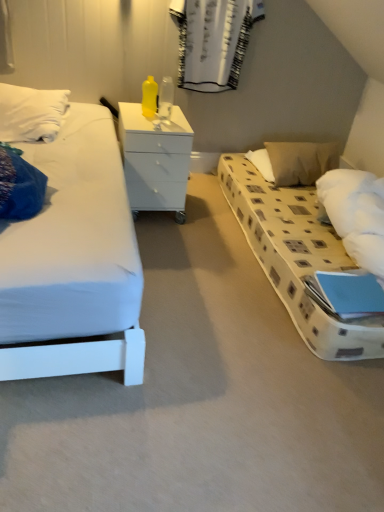
Question: Would you say beige fabric pillow at right is outside white glossy chest of drawers at center?

Choices:
 (A) no
 (B) yes

Answer: (B)

Question: From a real-world perspective, is beige fabric pillow at right positioned under white glossy chest of drawers at center based on gravity?

Choices:
 (A) yes
 (B) no

Answer: (A)

Question: From the image's perspective, is beige fabric pillow at right below white glossy chest of drawers at center?

Choices:
 (A) no
 (B) yes

Answer: (A)

Question: Are beige fabric pillow at right and white glossy chest of drawers at center located far from each other?

Choices:
 (A) yes
 (B) no

Answer: (B)

Question: Is beige fabric pillow at right touching white glossy chest of drawers at center?

Choices:
 (A) no
 (B) yes

Answer: (A)

Question: From the image's perspective, is beige fabric pillow at right positioned above or below white textured curtain at upper center?

Choices:
 (A) above
 (B) below

Answer: (B)

Question: In terms of size, does beige fabric pillow at right appear bigger or smaller than white textured curtain at upper center?

Choices:
 (A) small
 (B) big

Answer: (B)

Question: Considering the positions of beige fabric pillow at right and white textured curtain at upper center in the image, is beige fabric pillow at right taller or shorter than white textured curtain at upper center?

Choices:
 (A) short
 (B) tall

Answer: (A)

Question: In the image, is beige fabric pillow at right on the left side or the right side of white textured curtain at upper center?

Choices:
 (A) right
 (B) left

Answer: (A)

Question: Would you say white textured curtain at upper center is inside or outside beige fabric pillow at right?

Choices:
 (A) outside
 (B) inside

Answer: (A)

Question: Is white textured curtain at upper center bigger or smaller than beige fabric pillow at right?

Choices:
 (A) small
 (B) big

Answer: (A)

Question: From the image's perspective, is white textured curtain at upper center located above or below beige fabric pillow at right?

Choices:
 (A) below
 (B) above

Answer: (B)

Question: Is white textured curtain at upper center taller or shorter than beige fabric pillow at right?

Choices:
 (A) tall
 (B) short

Answer: (A)

Question: In terms of width, does white textured curtain at upper center look wider or thinner when compared to white glossy chest of drawers at center?

Choices:
 (A) wide
 (B) thin

Answer: (B)

Question: From the image's perspective, is white textured curtain at upper center located above or below white glossy chest of drawers at center?

Choices:
 (A) below
 (B) above

Answer: (B)